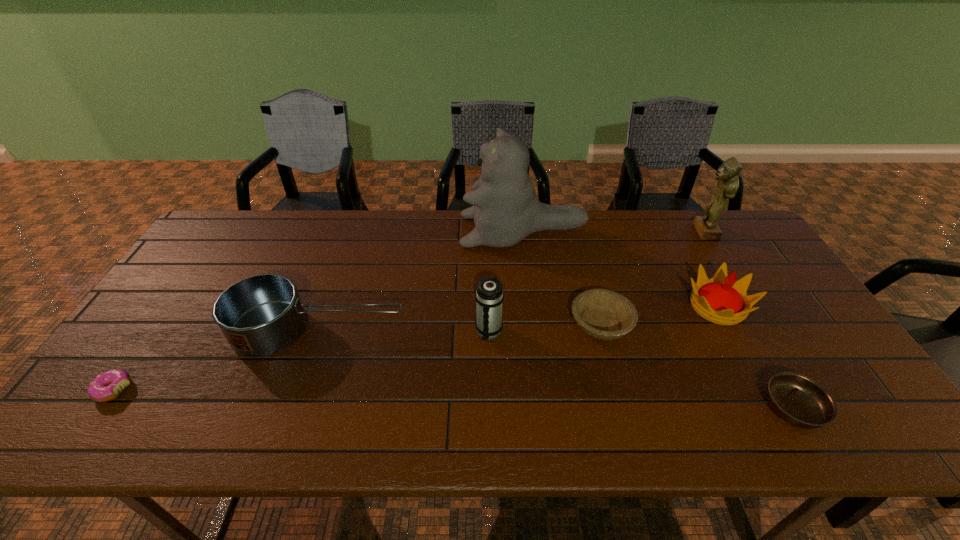
Identify the location of vacant space positioned 0.340m on the left of the soup bowl. This screenshot has height=540, width=960. (613, 408).

At what (x,y) coordinates should I click in order to perform the action: click on vacant space situated on the back of the shortest object. Please return your answer as a coordinate pair (x, y). The image size is (960, 540). Looking at the image, I should click on (140, 352).

At what (x,y) coordinates should I click in order to perform the action: click on cat located at the far edge. Please return your answer as a coordinate pair (x, y). This screenshot has width=960, height=540. Looking at the image, I should click on (505, 209).

Where is `figurine positioned at the far edge`? The height and width of the screenshot is (540, 960). figurine positioned at the far edge is located at coordinates (706, 226).

What are the coordinates of `object that is positioned at the near edge` in the screenshot? It's located at (797, 399).

Find the location of `object positioned at the left edge`. object positioned at the left edge is located at coordinates (107, 386).

You are a GUI agent. You are given a task and a screenshot of the screen. Output one action in this format:
    pyautogui.click(x=<x>, y=<y>)
    Task: Click on the figurine that is at the right edge
    Image resolution: width=960 pixels, height=540 pixels.
    Given the screenshot: What is the action you would take?
    pyautogui.click(x=706, y=226)

Locate an element on the screen. This screenshot has height=540, width=960. crown at the right edge is located at coordinates (722, 300).

Find the location of `soup bowl that is at the right edge`. soup bowl that is at the right edge is located at coordinates (797, 399).

The image size is (960, 540). I want to click on object present at the far right corner, so click(x=706, y=226).